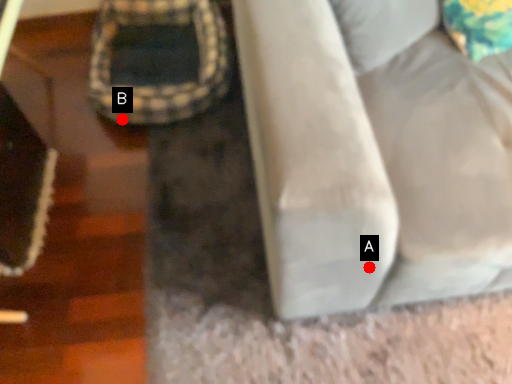
Question: Two points are circled on the image, labeled by A and B beside each circle. Among these points, which one is nearest to the camera?

Choices:
 (A) A is closer
 (B) B is closer

Answer: (A)